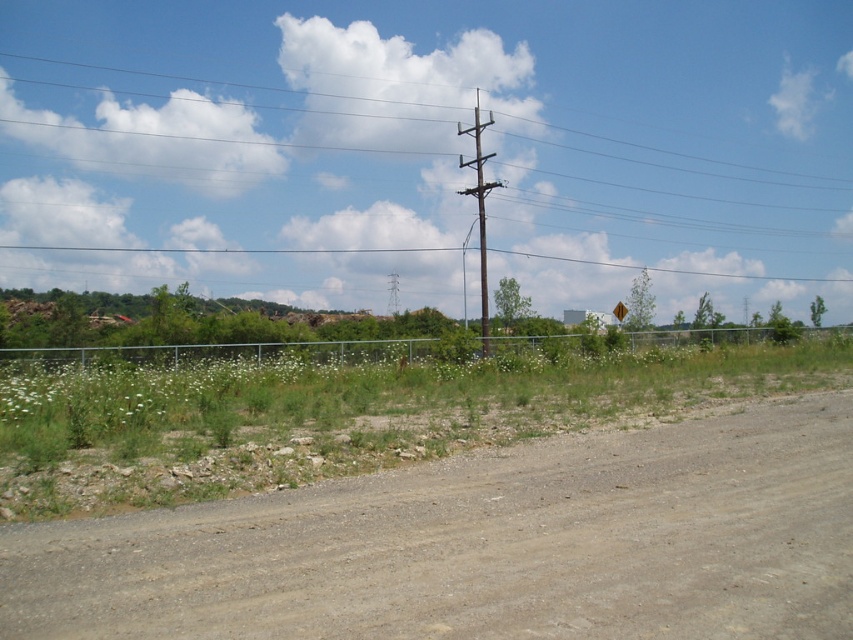
You are driving a car that is 2 meters wide. You see the brown gravel dirt track at lower left and the brown wooden telegraph pole at center. Can your car pass through the track without hitting the pole?

The brown gravel dirt track at lower left might be wider than brown wooden telegraph pole at center, so it is possible that the car can pass through the track without hitting the pole, but there is uncertainty due to the comparative width not being definitively stated.

You are a hiker who wants to cross the brown gravel dirt track at lower left and reach the brown wooden pole at upper center. Which object is smaller in size?

The brown gravel dirt track at lower left is smaller in size compared to the brown wooden pole at upper center.

You are standing at the brown wooden pole at upper center and want to walk to the brown gravel dirt track at lower left. Which direction should you head?

The brown gravel dirt track at lower left is to the right of the brown wooden pole at upper center, so you should head to the right to reach it.